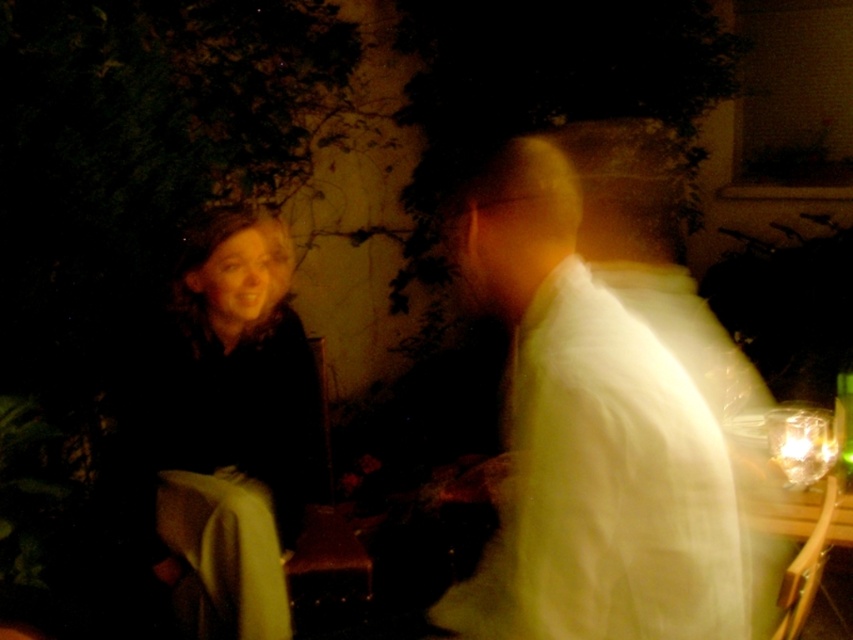
Looking at this image, can you confirm if white matte shirt at center is positioned below dark brown fabric coat at left?

Yes.

Where is `white matte shirt at center`? white matte shirt at center is located at coordinates (590, 436).

You are a GUI agent. You are given a task and a screenshot of the screen. Output one action in this format:
    pyautogui.click(x=<x>, y=<y>)
    Task: Click on the white matte shirt at center
    
    Given the screenshot: What is the action you would take?
    pyautogui.click(x=590, y=436)

Is white glossy shirt at upper right positioned before dark brown fabric coat at left?

That is False.

Who is positioned more to the right, white glossy shirt at upper right or dark brown fabric coat at left?

Positioned to the right is white glossy shirt at upper right.

Which is behind, point (683, 467) or point (200, 630)?

Point (200, 630)

This screenshot has height=640, width=853. Identify the location of white glossy shirt at upper right. click(x=601, y=412).

Is white glossy shirt at upper right to the left of white matte shirt at center from the viewer's perspective?

No, white glossy shirt at upper right is not to the left of white matte shirt at center.

Who is positioned more to the right, white glossy shirt at upper right or white matte shirt at center?

From the viewer's perspective, white glossy shirt at upper right appears more on the right side.

Is point (612, 205) farther from viewer compared to point (674, 474)?

That is True.

I want to click on white glossy shirt at upper right, so [601, 412].